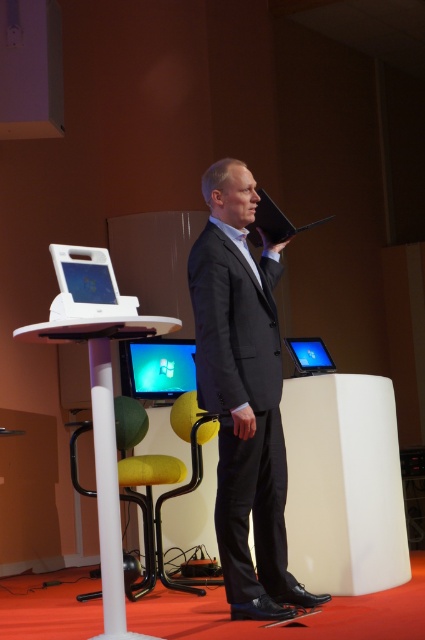
Locate an element on the screen. Image resolution: width=425 pixels, height=640 pixels. white glossy podium at center is located at coordinates (104, 440).

Which of these two, white glossy podium at center or yellow fabric swivel chair at lower center, stands taller?

Standing taller between the two is white glossy podium at center.

Between point (96, 413) and point (163, 566), which one is positioned in front?

Point (96, 413) is more forward.

Find the location of a particular element. This screenshot has height=640, width=425. white glossy podium at center is located at coordinates (104, 440).

Which is in front, point (108, 276) or point (297, 344)?

Point (108, 276)

You are a GUI agent. You are given a task and a screenshot of the screen. Output one action in this format:
    pyautogui.click(x=<x>, y=<y>)
    Task: Click on the white plastic laptop at center
    This screenshot has height=640, width=425.
    Given the screenshot: What is the action you would take?
    pyautogui.click(x=87, y=284)

Find the location of `white plastic laptop at center`. white plastic laptop at center is located at coordinates (87, 284).

Consider the image. Which of these two, yellow fabric swivel chair at lower center or matte black laptop at center, stands shorter?

matte black laptop at center is shorter.

Identify the location of yellow fabric swivel chair at lower center. This screenshot has height=640, width=425. (167, 492).